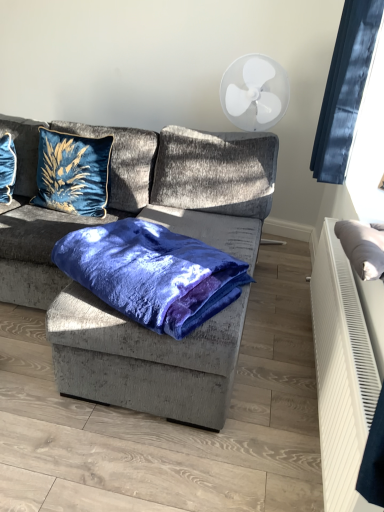
At what (x,y) coordinates should I click in order to perform the action: click on black fabric at upper right. Please return your answer as a coordinate pair (x, y). Looking at the image, I should click on (345, 88).

Image resolution: width=384 pixels, height=512 pixels. Describe the element at coordinates (345, 88) in the screenshot. I see `black fabric at upper right` at that location.

The image size is (384, 512). What are the coordinates of `velvet grey couch at center` in the screenshot? It's located at (174, 231).

The width and height of the screenshot is (384, 512). What do you see at coordinates (73, 173) in the screenshot?
I see `velvet blue pillow at upper left, the 2th pillow from the back` at bounding box center [73, 173].

Find the location of a particular element. black fabric at upper right is located at coordinates (345, 88).

Is black fabric at upper right facing towards velvet grey couch at center?

No, black fabric at upper right is not turned towards velvet grey couch at center.

Is black fabric at upper right bigger or smaller than velvet grey couch at center?

Clearly, black fabric at upper right is smaller in size than velvet grey couch at center.

Which object is positioned more to the left, black fabric at upper right or velvet grey couch at center?

Positioned to the left is velvet grey couch at center.

Could velvet grey couch at center be considered to be inside gray fabric pillow at right, which appears as the third pillow when viewed from the back?

No.

Based on the photo, from a real-world perspective, is gray fabric pillow at right, which appears as the third pillow when viewed from the back, located beneath velvet grey couch at center?

Incorrect, from a real-world perspective, gray fabric pillow at right, which appears as the third pillow when viewed from the back, is higher than velvet grey couch at center.

Considering the relative sizes of gray fabric pillow at right, the 1th pillow positioned from the right, and velvet grey couch at center in the image provided, is gray fabric pillow at right, the 1th pillow positioned from the right, smaller than velvet grey couch at center?

Yes, gray fabric pillow at right, the 1th pillow positioned from the right, is smaller than velvet grey couch at center.

Looking at this image, which of these two, gray fabric pillow at right, which ranks as the 1th pillow in front-to-back order, or velvet grey couch at center, is wider?

velvet grey couch at center is wider.

Which is behind, velvet blue blanket at center or velvet blue pillow at upper left, positioned as the 2th pillow in left-to-right order?

velvet blue pillow at upper left, positioned as the 2th pillow in left-to-right order.

Visually, is velvet blue blanket at center positioned to the left or to the right of velvet blue pillow at upper left, the second pillow viewed from the right?

velvet blue blanket at center is to the right of velvet blue pillow at upper left, the second pillow viewed from the right.

Which is more distant, [151,260] or [42,154]?

The point [42,154] is behind.

Is velvet blue pillow at upper left, positioned as the 1th pillow in back-to-front order, touching velvet grey couch at center?

velvet blue pillow at upper left, positioned as the 1th pillow in back-to-front order, and velvet grey couch at center are clearly separated.

Which object is positioned more to the right, velvet blue pillow at upper left, placed as the first pillow when sorted from left to right, or velvet grey couch at center?

velvet grey couch at center.

Is velvet blue pillow at upper left, placed as the first pillow when sorted from left to right, turned away from velvet grey couch at center?

Yes, velvet grey couch at center is at the back of velvet blue pillow at upper left, placed as the first pillow when sorted from left to right.

The height and width of the screenshot is (512, 384). I want to click on pillow that is the 2nd one when counting upward from the velvet grey couch at center (from the image's perspective), so click(x=24, y=151).

Does velvet grey couch at center contain velvet blue blanket at center?

Yes, velvet grey couch at center is surrounding velvet blue blanket at center.

Considering the positions of point (160, 148) and point (132, 225), is point (160, 148) closer or farther from the camera than point (132, 225)?

Point (160, 148) is farther from the camera than point (132, 225).

Does velvet grey couch at center come behind velvet blue blanket at center?

No, the depth of velvet grey couch at center is less than that of velvet blue blanket at center.

Considering the sizes of velvet grey couch at center and gray fabric pillow at right, which ranks as the 1th pillow in front-to-back order, in the image, is velvet grey couch at center bigger or smaller than gray fabric pillow at right, which ranks as the 1th pillow in front-to-back order,?

In the image, velvet grey couch at center appears to be larger than gray fabric pillow at right, which ranks as the 1th pillow in front-to-back order.

Is gray fabric pillow at right, which ranks as the 1th pillow in front-to-back order, at the back of velvet grey couch at center?

No, velvet grey couch at center is not facing the opposite direction of gray fabric pillow at right, which ranks as the 1th pillow in front-to-back order.

From a real-world perspective, is velvet grey couch at center positioned above or below gray fabric pillow at right, which ranks as the 1th pillow in front-to-back order?

In terms of real-world spatial position, velvet grey couch at center is below gray fabric pillow at right, which ranks as the 1th pillow in front-to-back order.

Is velvet grey couch at center far from velvet blue pillow at upper left, the second pillow viewed from the right?

That's not correct — velvet grey couch at center is a little close to velvet blue pillow at upper left, the second pillow viewed from the right.

Between point (31, 268) and point (48, 167), which one is positioned in front?

Positioned in front is point (31, 268).

Considering the sizes of objects velvet grey couch at center and velvet blue pillow at upper left, the second pillow viewed from the right, in the image provided, who is shorter, velvet grey couch at center or velvet blue pillow at upper left, the second pillow viewed from the right,?

velvet blue pillow at upper left, the second pillow viewed from the right.

In order to click on studio couch that is below the velvet blue pillow at upper left, the 2th pillow from the back (from the image's perspective) in this screenshot , I will do `click(174, 231)`.

Where is `studio couch below the black fabric at upper right (from a real-world perspective)`? The width and height of the screenshot is (384, 512). studio couch below the black fabric at upper right (from a real-world perspective) is located at coordinates click(x=174, y=231).

You are a GUI agent. You are given a task and a screenshot of the screen. Output one action in this format:
    pyautogui.click(x=<x>, y=<y>)
    Task: Click on the studio couch that appears in front of the gray fabric pillow at right, the 1th pillow positioned from the right
    The image size is (384, 512).
    Given the screenshot: What is the action you would take?
    pyautogui.click(x=174, y=231)

Which object lies further to the anchor point black fabric at upper right, velvet grey couch at center or gray fabric pillow at right, which ranks as the 3th pillow in left-to-right order?

Among the two, gray fabric pillow at right, which ranks as the 3th pillow in left-to-right order, is located further to black fabric at upper right.

Estimate the real-world distances between objects in this image. Which object is further from velvet grey couch at center, velvet blue blanket at center or velvet blue pillow at upper left, positioned as the 1th pillow in back-to-front order?

Based on the image, velvet blue pillow at upper left, positioned as the 1th pillow in back-to-front order, appears to be further to velvet grey couch at center.

Looking at the image, which one is located further to black fabric at upper right, gray fabric pillow at right, which ranks as the 3th pillow in left-to-right order, or velvet blue pillow at upper left, which is the 3th pillow from right to left?

The object further to black fabric at upper right is velvet blue pillow at upper left, which is the 3th pillow from right to left.

Considering their positions, is velvet blue pillow at upper left, positioned as the 1th pillow in back-to-front order, positioned closer to gray fabric pillow at right, the 1th pillow positioned from the right, than black fabric at upper right?

Based on the image, black fabric at upper right appears to be nearer to gray fabric pillow at right, the 1th pillow positioned from the right.

Estimate the real-world distances between objects in this image. Which object is closer to velvet blue pillow at upper left, positioned as the 1th pillow in back-to-front order, black fabric at upper right or velvet blue pillow at upper left, the second pillow viewed from the right?

velvet blue pillow at upper left, the second pillow viewed from the right, is closer to velvet blue pillow at upper left, positioned as the 1th pillow in back-to-front order.

Considering their positions, is velvet blue pillow at upper left, the 2th pillow from the back, positioned further to black fabric at upper right than velvet blue blanket at center?

velvet blue pillow at upper left, the 2th pillow from the back, is further to black fabric at upper right.

Which object lies nearer to the anchor point gray fabric pillow at right, which ranks as the 3th pillow in left-to-right order, velvet blue pillow at upper left, which is counted as the 3th pillow, starting from the front, or velvet blue pillow at upper left, acting as the 2th pillow starting from the front?

velvet blue pillow at upper left, acting as the 2th pillow starting from the front.

Which object lies nearer to the anchor point velvet blue pillow at upper left, which is counted as the 3th pillow, starting from the front, gray fabric pillow at right, which ranks as the 1th pillow in front-to-back order, or black fabric at upper right?

black fabric at upper right.

Identify the location of cloth between velvet blue pillow at upper left, acting as the 2th pillow starting from the front, and black fabric at upper right, in the horizontal direction. The height and width of the screenshot is (512, 384). (152, 273).

I want to click on cloth located between velvet blue pillow at upper left, positioned as the 2th pillow in left-to-right order, and gray fabric pillow at right, which ranks as the 3th pillow in left-to-right order, in the left-right direction, so click(x=152, y=273).

The width and height of the screenshot is (384, 512). Identify the location of studio couch situated between velvet blue pillow at upper left, placed as the first pillow when sorted from left to right, and black fabric at upper right from left to right. (174, 231).

Find the location of a particular element. cloth between velvet blue pillow at upper left, which is counted as the 3th pillow, starting from the front, and black fabric at upper right is located at coordinates (152, 273).